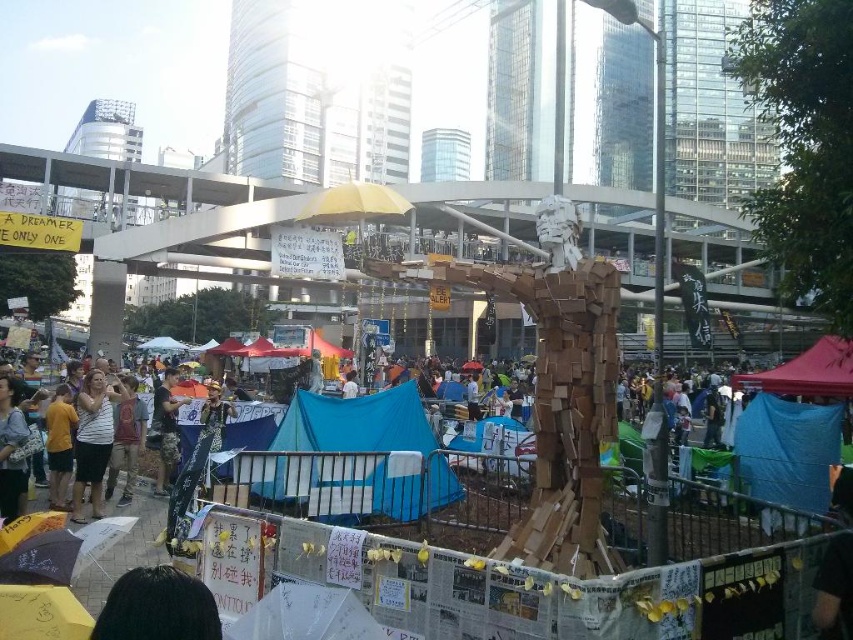
Question: Which point is farther to the camera?

Choices:
 (A) (83, 515)
 (B) (171, 422)
 (C) (67, 448)

Answer: (B)

Question: Does white striped shirt at center have a smaller size compared to yellow fabric at lower left?

Choices:
 (A) no
 (B) yes

Answer: (A)

Question: Can you confirm if white striped shirt at center is thinner than red fabric canopy at lower right?

Choices:
 (A) no
 (B) yes

Answer: (B)

Question: Which point is closer to the camera?

Choices:
 (A) (165, 378)
 (B) (57, 451)
 (C) (805, 385)
 (D) (345, 433)

Answer: (B)

Question: Which object appears farthest from the camera in this image?

Choices:
 (A) white striped shirt at center
 (B) blue fabric tent at center
 (C) red fabric canopy at lower right
 (D) camouflage pants at center

Answer: (D)

Question: Can you confirm if blue fabric tent at center is bigger than white striped shirt at center?

Choices:
 (A) yes
 (B) no

Answer: (A)